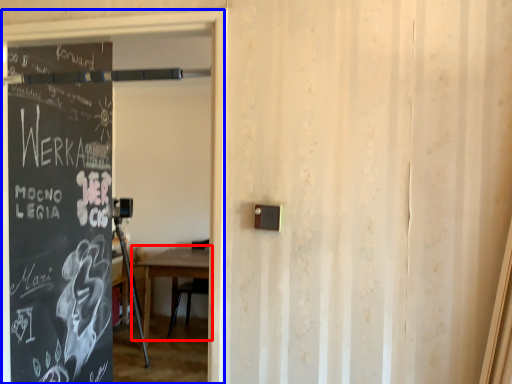
Question: Among these objects, which one is nearest to the camera, table (highlighted by a red box) or garage door (highlighted by a blue box)?

Choices:
 (A) table
 (B) garage door

Answer: (B)